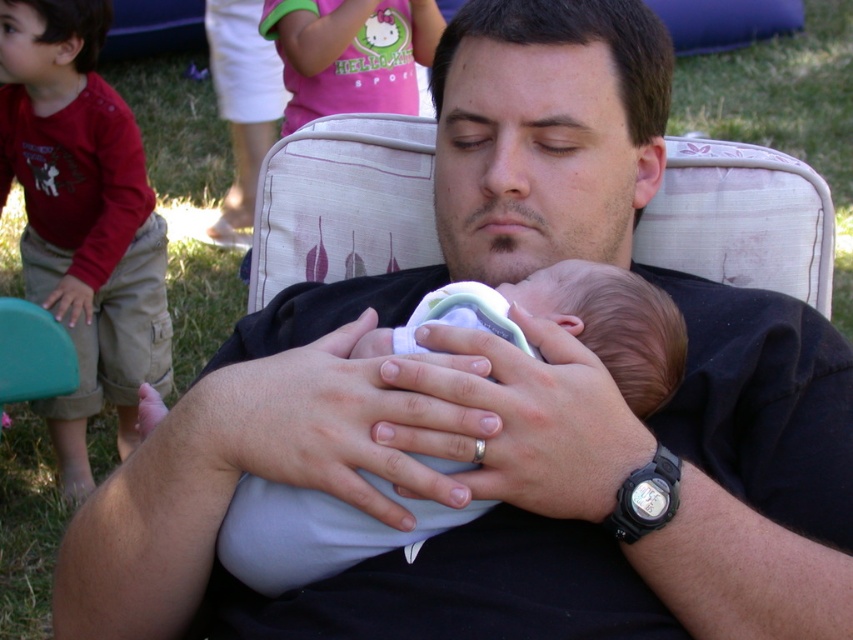
Between point (293, 554) and point (289, 116), which one is positioned in front?

Point (293, 554) is more forward.

Image resolution: width=853 pixels, height=640 pixels. Describe the element at coordinates (567, 323) in the screenshot. I see `light blue fabric baby at center` at that location.

Which is behind, point (303, 536) or point (416, 38)?

Point (416, 38)

Where is `light blue fabric baby at center`? The width and height of the screenshot is (853, 640). light blue fabric baby at center is located at coordinates (567, 323).

Is red cotton shirt at left positioned in front of pink cotton shirt at upper center?

Yes, it is in front of pink cotton shirt at upper center.

At what (x,y) coordinates should I click in order to perform the action: click on red cotton shirt at left. Please return your answer as a coordinate pair (x, y). This screenshot has width=853, height=640. Looking at the image, I should click on (82, 218).

Does point (115, 339) come closer to viewer compared to point (264, 35)?

Yes, it is.

What are the coordinates of `red cotton shirt at left` in the screenshot? It's located at (82, 218).

Is red cotton shirt at left thinner than light blue fabric baby at center?

No.

Is point (142, 296) behind point (479, 285)?

Yes.

Where is `red cotton shirt at left`? This screenshot has height=640, width=853. red cotton shirt at left is located at coordinates (82, 218).